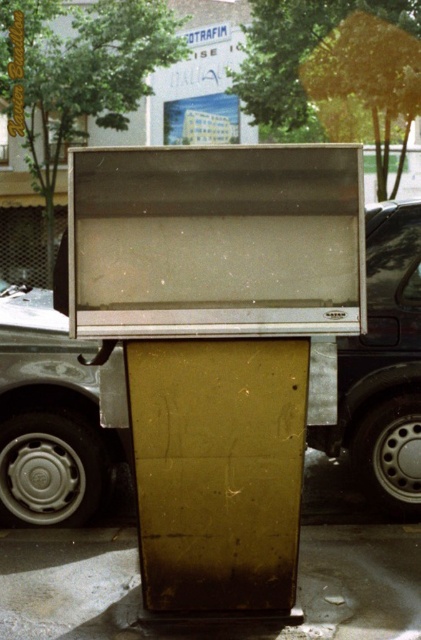
Based on the photo, you are a delivery person trying to park your metallic silver car at center near the vintage TV. The smooth concrete pavement at center is where you want to park. Can you park the car there without damaging the pavement?

The metallic silver car at center is positioned over smooth concrete pavement at center, which means the car is already parked there. Since the pavement is smooth, it can likely handle the car without damage.

You are a delivery person who needs to place a package on the ground. There is a matte brown cardboard box at center and a metallic silver car at center. Can you place the package on the ground in front of both objects without it being under either?

The matte brown cardboard box at center is positioned under the metallic silver car at center, so placing the package on the ground in front of both would require placing it in front of the metallic silver car at center and the matte brown cardboard box at center, ensuring it is not underneath either object.